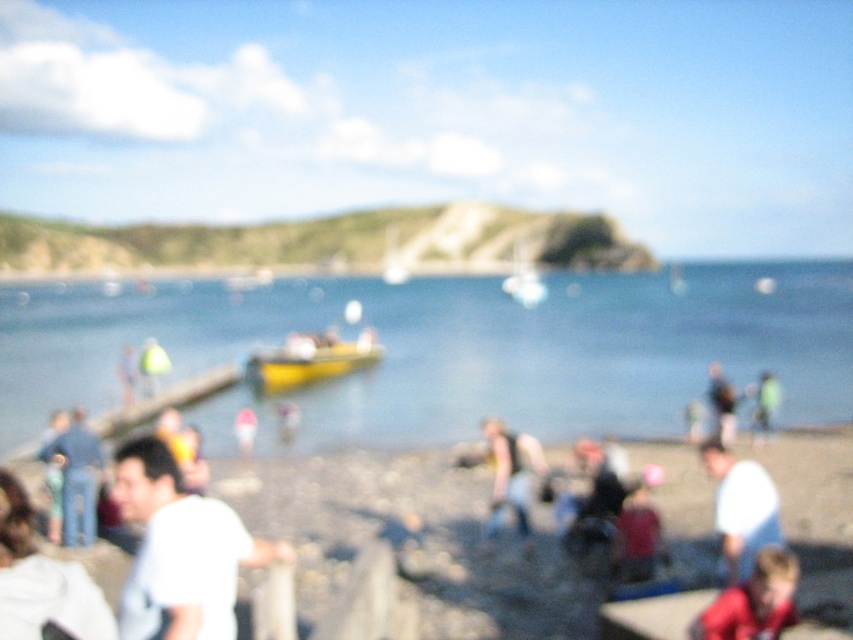
You are a photographer standing at the shoreline in the image. You notice two people wearing white shirts in the scene. One is wearing a white matte shirt at lower left and the other a white cotton shirt at lower right. Which of these two shirts is taller?

The white matte shirt at lower left is taller than the white cotton shirt at lower right.

You are standing on the wooden pier and want to get to the blue water at center. Which direction should you move relative to the yellow matte boat at center?

The blue water at center is above the yellow matte boat at center, so you should move upward towards the blue water at center to reach it.

You are a photographer trying to capture a group photo of the two people wearing white matte shirt at lower left and white cotton shirt at lower right. Since the scene is blurry, you need to adjust your camera focus. Which person should you focus on first to ensure both are in frame?

You should focus on the white cotton shirt at lower right first because the white matte shirt at lower left is to the left of it, so adjusting focus on the right side will help capture both in the frame.